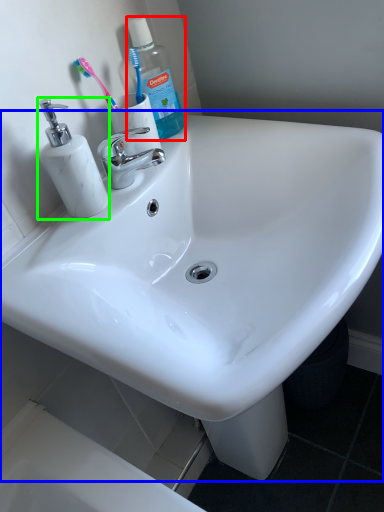
Question: Which object is positioned farthest from cleaning product (highlighted by a red box)? Select from sink (highlighted by a blue box) and soap dispenser (highlighted by a green box).

Choices:
 (A) sink
 (B) soap dispenser

Answer: (A)